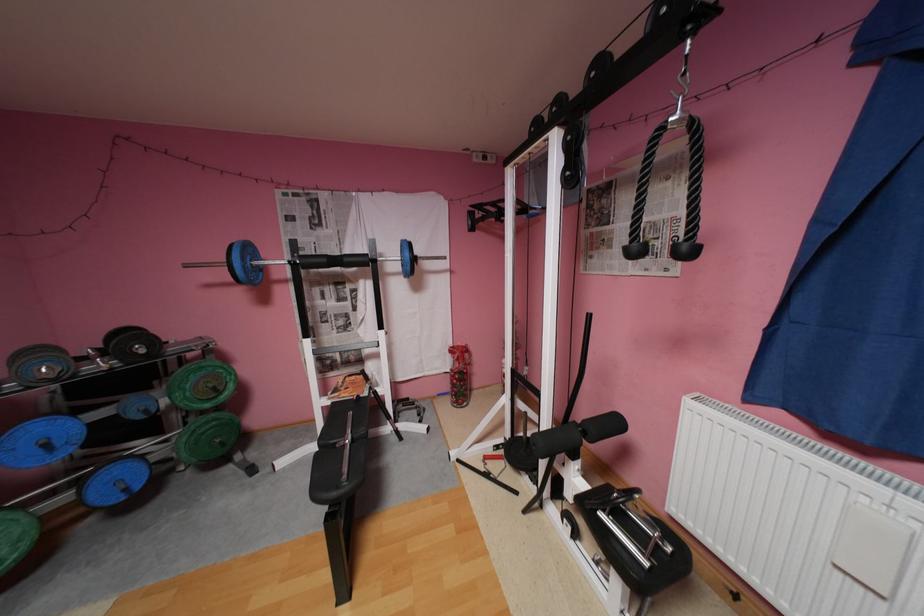
You are a GUI agent. You are given a task and a screenshot of the screen. Output one action in this format:
    pyautogui.click(x=<x>, y=<y>)
    Task: Click on the black rope handle
    
    Given the screenshot: What is the action you would take?
    pyautogui.click(x=691, y=193)